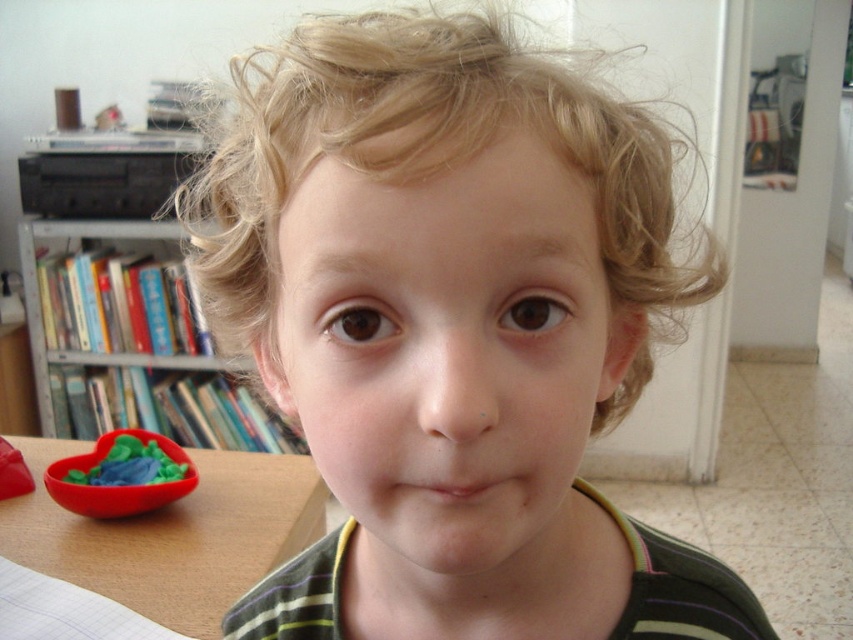
Between hardcover books at left and rubber heart at lower left, which one has more height?

With more height is hardcover books at left.

Measure the distance between point (140, 365) and camera.

2.44 meters

Who is more distant from viewer, (180,416) or (166,438)?

Positioned behind is point (180,416).

Locate an element on the screen. The width and height of the screenshot is (853, 640). hardcover books at left is located at coordinates (132, 340).

Between hardcover books at left and wooden table at lower left, which one appears on the left side from the viewer's perspective?

hardcover books at left

Between point (120, 362) and point (218, 582), which one is positioned behind?

Point (120, 362)

Where is `hardcover books at left`? Image resolution: width=853 pixels, height=640 pixels. hardcover books at left is located at coordinates (132, 340).

Who is shorter, smooth skin child at center or wooden table at lower left?

Standing shorter between the two is wooden table at lower left.

Locate an element on the screen. smooth skin child at center is located at coordinates (453, 333).